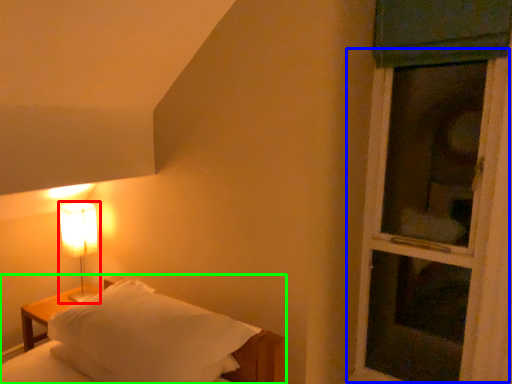
Question: Which object is the closest to the lamp (highlighted by a red box)? Choose among these: screen door (highlighted by a blue box) or bed (highlighted by a green box).

Choices:
 (A) screen door
 (B) bed

Answer: (B)